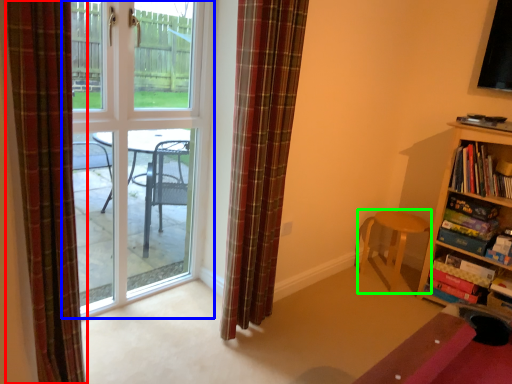
Question: Based on their relative distances, which object is farther from curtain (highlighted by a red box)? Choose from door (highlighted by a blue box) and chair (highlighted by a green box).

Choices:
 (A) door
 (B) chair

Answer: (B)